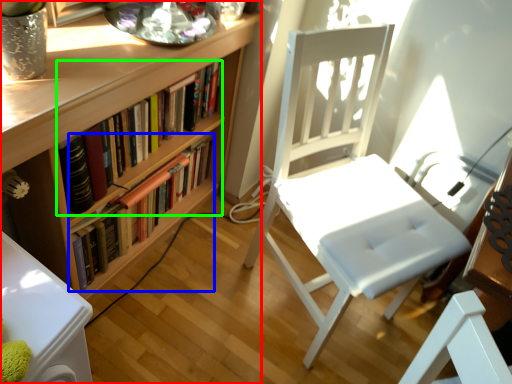
Question: Which object is positioned closest to bookcase (highlighted by a red box)? Select from book (highlighted by a blue box) and book (highlighted by a green box).

Choices:
 (A) book
 (B) book

Answer: (B)